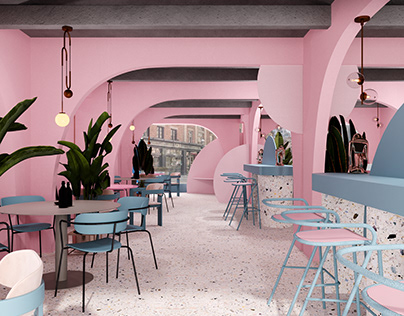
You are a GUI agent. You are given a task and a screenshot of the screen. Output one action in this format:
    pyautogui.click(x=<x>, y=<y>)
    Task: Click on the plant
    This screenshot has width=404, height=316.
    Given the screenshot: What is the action you would take?
    pyautogui.click(x=90, y=173), pyautogui.click(x=28, y=153), pyautogui.click(x=142, y=156)